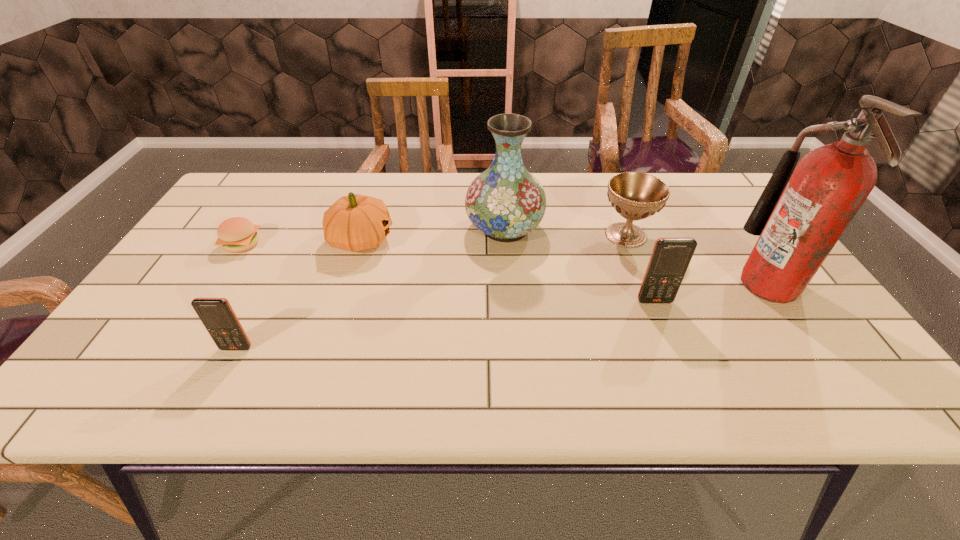
In order to click on free space that satisfies the following two spatial constraints: 1. on the front side of the chalice; 2. on the side of the fifth object from right to left with the carved face in this screenshot , I will do `click(628, 240)`.

Locate an element on the screen. free point that satisfies the following two spatial constraints: 1. on the front side of the chalice; 2. on the side of the fifth object from right to left with the carved face is located at coordinates (628, 240).

The width and height of the screenshot is (960, 540). What are the coordinates of `free region that satisfies the following two spatial constraints: 1. on the back side of the chalice; 2. on the left side of the shortest object` in the screenshot? It's located at pyautogui.click(x=248, y=235).

Find the location of a particular element. vacant space that satisfies the following two spatial constraints: 1. on the front of the tallest object near the operation label; 2. on the screen of the left cellular telephone is located at coordinates (813, 348).